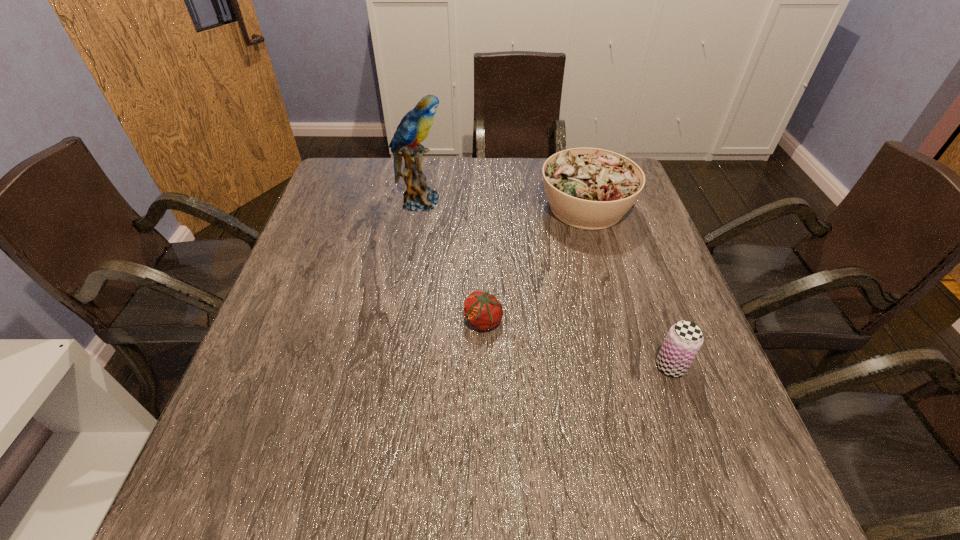
Identify the location of vacant space at the near right corner of the desktop. This screenshot has height=540, width=960. (766, 504).

Locate an element on the screen. This screenshot has width=960, height=540. free space between the third object from right to left and the beer can is located at coordinates (577, 343).

Locate an element on the screen. free space that is in between the shortest object and the nearest object is located at coordinates (577, 343).

The image size is (960, 540). What are the coordinates of `free space that is in between the third farthest object and the salad` in the screenshot? It's located at (535, 264).

This screenshot has height=540, width=960. In order to click on vacant area that lies between the salad and the tallest object in this screenshot , I will do `click(503, 205)`.

Where is `unoccupied area between the second object from left to right and the beer can`? This screenshot has width=960, height=540. unoccupied area between the second object from left to right and the beer can is located at coordinates (577, 343).

You are a GUI agent. You are given a task and a screenshot of the screen. Output one action in this format:
    pyautogui.click(x=<x>, y=<y>)
    Task: Click on the vacant space in between the salad and the nearest object
    Image resolution: width=960 pixels, height=540 pixels.
    Given the screenshot: What is the action you would take?
    (629, 287)

I want to click on free space between the salad and the nearest object, so click(629, 287).

Where is `vacant region between the leftmost object and the tomato`? This screenshot has height=540, width=960. vacant region between the leftmost object and the tomato is located at coordinates (451, 261).

Find the location of `empty space between the nearest object and the second object from left to right`. empty space between the nearest object and the second object from left to right is located at coordinates (577, 343).